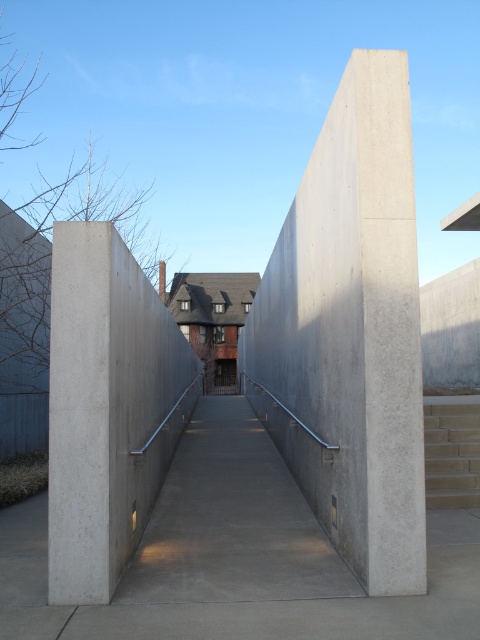
Question: Estimate the real-world distances between objects in this image. Which object is closer to the smooth concrete wall at center?

Choices:
 (A) smooth concrete ramp at center
 (B) smooth concrete pillar at center

Answer: (A)

Question: Which object appears closest to the camera in this image?

Choices:
 (A) light brown brick stairs at right
 (B) smooth concrete wall at center
 (C) smooth concrete ramp at center

Answer: (B)

Question: Which object is closer to the camera taking this photo?

Choices:
 (A) light brown brick stairs at right
 (B) smooth concrete pillar at center

Answer: (B)

Question: Is smooth concrete wall at center smaller than light brown brick stairs at right?

Choices:
 (A) yes
 (B) no

Answer: (B)

Question: Does smooth concrete pillar at center lie behind light brown brick stairs at right?

Choices:
 (A) yes
 (B) no

Answer: (B)

Question: Is smooth concrete ramp at center thinner than light brown brick stairs at right?

Choices:
 (A) no
 (B) yes

Answer: (A)